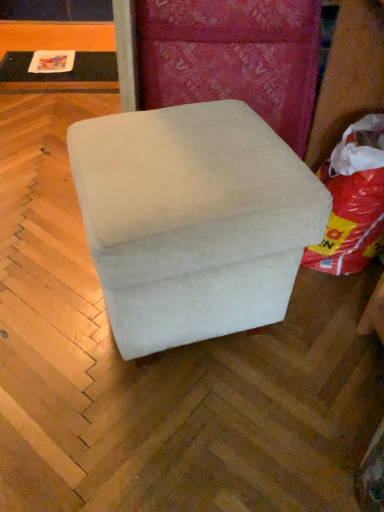
Question: Considering their positions, is white fabric bean bag at right located in front of or behind matte black table at upper left?

Choices:
 (A) behind
 (B) front

Answer: (B)

Question: From a real-world perspective, relative to matte black table at upper left, is white fabric bean bag at right vertically above or below?

Choices:
 (A) below
 (B) above

Answer: (B)

Question: Estimate the real-world distances between objects in this image. Which object is farther from the white fabric bean bag at right?

Choices:
 (A) white fabric ottoman at center
 (B) matte black table at upper left

Answer: (B)

Question: Which of these objects is positioned farthest from the matte black table at upper left?

Choices:
 (A) white fabric ottoman at center
 (B) white fabric bean bag at right

Answer: (A)